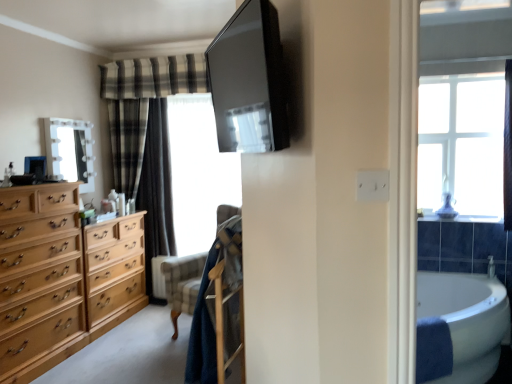
Question: Is plaid fabric curtain at left at the back of light brown wood chest of drawers at left?

Choices:
 (A) yes
 (B) no

Answer: (B)

Question: Is light brown wood chest of drawers at left closer to the viewer compared to plaid fabric curtain at left?

Choices:
 (A) yes
 (B) no

Answer: (A)

Question: Does light brown wood chest of drawers at left have a greater width compared to plaid fabric curtain at left?

Choices:
 (A) yes
 (B) no

Answer: (A)

Question: From a real-world perspective, is light brown wood chest of drawers at left on plaid fabric curtain at left?

Choices:
 (A) yes
 (B) no

Answer: (B)

Question: Can we say light brown wood chest of drawers at left lies outside plaid fabric curtain at left?

Choices:
 (A) no
 (B) yes

Answer: (B)

Question: Considering the relative sizes of light brown wood chest of drawers at left and plaid fabric curtain at left in the image provided, is light brown wood chest of drawers at left shorter than plaid fabric curtain at left?

Choices:
 (A) no
 (B) yes

Answer: (B)

Question: From a real-world perspective, is light brown wood chest of drawers at left physically above velvet-like beige armchair at center?

Choices:
 (A) yes
 (B) no

Answer: (B)

Question: From the image's perspective, is light brown wood chest of drawers at left below velvet-like beige armchair at center?

Choices:
 (A) no
 (B) yes

Answer: (B)

Question: Does light brown wood chest of drawers at left contain velvet-like beige armchair at center?

Choices:
 (A) no
 (B) yes

Answer: (A)

Question: Does light brown wood chest of drawers at left have a greater width compared to velvet-like beige armchair at center?

Choices:
 (A) no
 (B) yes

Answer: (B)

Question: Is light brown wood chest of drawers at left outside velvet-like beige armchair at center?

Choices:
 (A) yes
 (B) no

Answer: (A)

Question: Is light brown wood chest of drawers at left bigger than velvet-like beige armchair at center?

Choices:
 (A) no
 (B) yes

Answer: (B)

Question: Is white glossy mirror at upper left positioned behind velvet-like beige armchair at center?

Choices:
 (A) no
 (B) yes

Answer: (B)